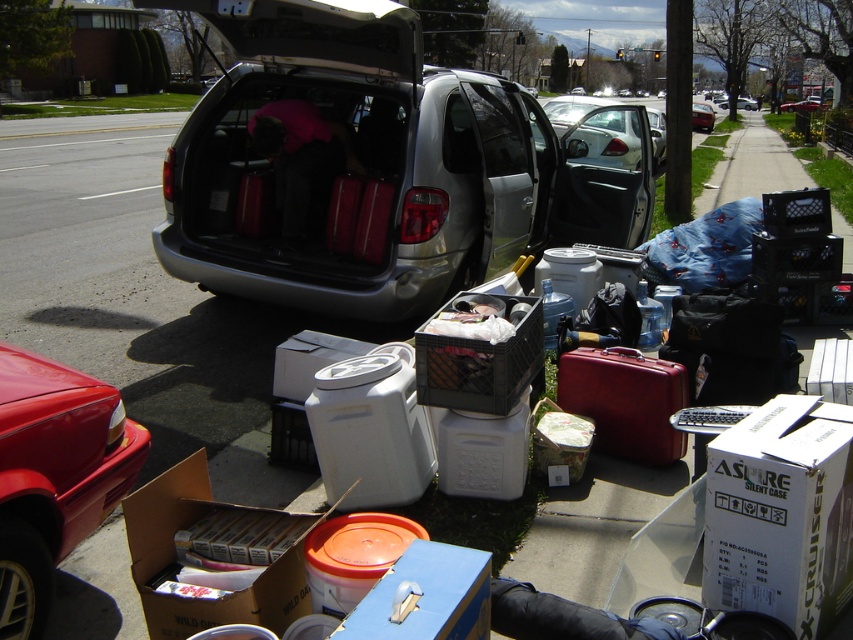
Which object is located at the coordinates point (x=780, y=515)?

The point (x=780, y=515) is on the white cardboard box at lower right.

You are a delivery person trying to park your van next to the shiny red car at lower left and the metallic silver minivan at center. Based on the space they occupy, which vehicle should you park closer to?

Since the shiny red car at lower left occupies less space than the metallic silver minivan at center, you should park closer to the shiny red car at lower left to allow enough room for your van.